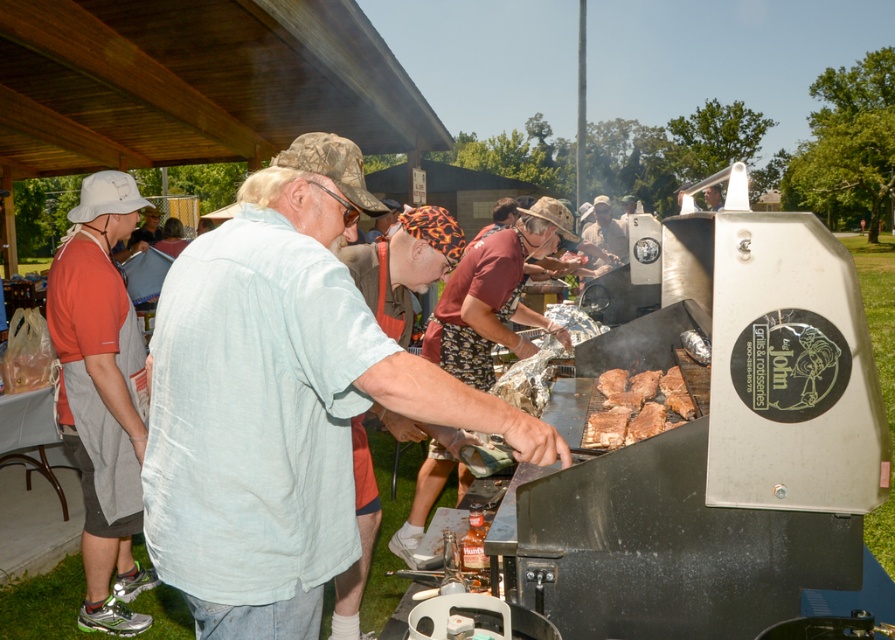
This screenshot has width=895, height=640. Describe the element at coordinates (280, 401) in the screenshot. I see `light blue cotton shirt at center` at that location.

Between light blue cotton shirt at center and matte khaki shirt at center, which one has more height?

light blue cotton shirt at center

At what (x,y) coordinates should I click in order to perform the action: click on light blue cotton shirt at center. Please return your answer as a coordinate pair (x, y). The height and width of the screenshot is (640, 895). Looking at the image, I should click on (280, 401).

Is brown matte ribs at center wider than matte khaki shirt at center?

Correct, the width of brown matte ribs at center exceeds that of matte khaki shirt at center.

Does brown matte ribs at center have a larger size compared to matte khaki shirt at center?

Actually, brown matte ribs at center might be smaller than matte khaki shirt at center.

Locate an element on the screen. The height and width of the screenshot is (640, 895). brown matte ribs at center is located at coordinates (635, 406).

Between light blue cotton shirt at center and orange t-shirt at left, which one has less height?

light blue cotton shirt at center is shorter.

Is light blue cotton shirt at center above orange t-shirt at left?

Indeed, light blue cotton shirt at center is positioned over orange t-shirt at left.

Locate an element on the screen. This screenshot has height=640, width=895. light blue cotton shirt at center is located at coordinates (280, 401).

Image resolution: width=895 pixels, height=640 pixels. In order to click on light blue cotton shirt at center in this screenshot , I will do `click(280, 401)`.